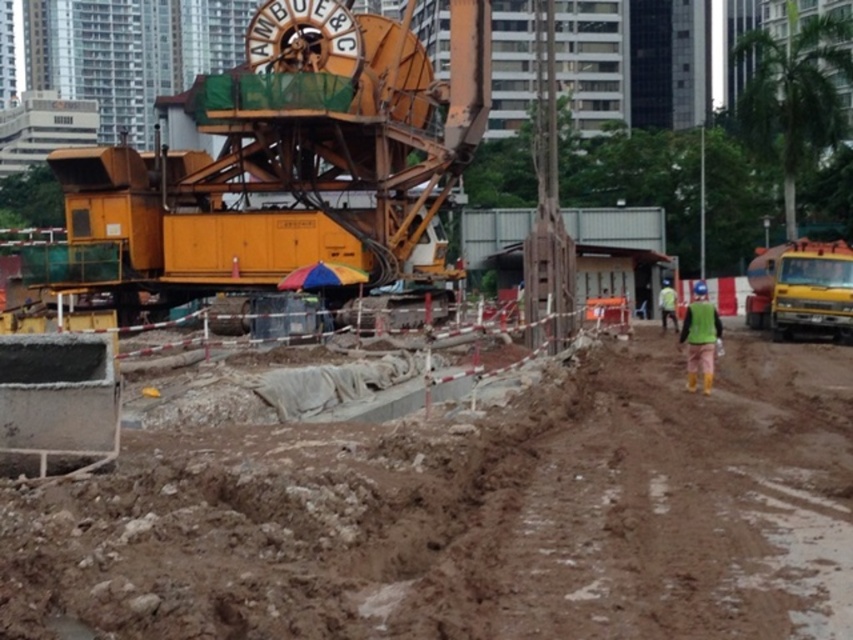
Question: Does brown clay dirt field at lower left have a smaller size compared to green fabric construction worker at right?

Choices:
 (A) no
 (B) yes

Answer: (B)

Question: Which of the following is the closest to the observer?

Choices:
 (A) brown clay dirt field at lower left
 (B) green fabric construction worker at right

Answer: (A)

Question: Which of the following is the farthest from the observer?

Choices:
 (A) green fabric construction worker at right
 (B) brown clay dirt field at lower left

Answer: (A)

Question: Is brown clay dirt field at lower left closer to the viewer compared to green fabric construction worker at right?

Choices:
 (A) yes
 (B) no

Answer: (A)

Question: Is brown clay dirt field at lower left thinner than green fabric construction worker at right?

Choices:
 (A) yes
 (B) no

Answer: (B)